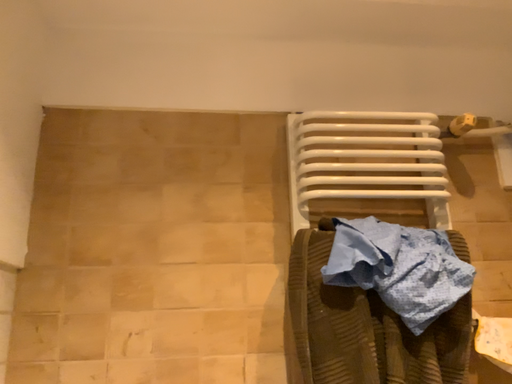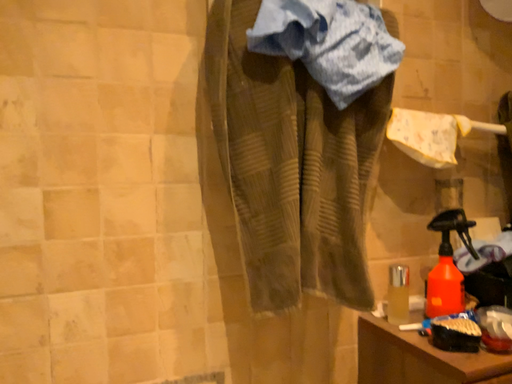
Question: How did the camera likely rotate when shooting the video?

Choices:
 (A) rotated upward
 (B) rotated downward

Answer: (B)